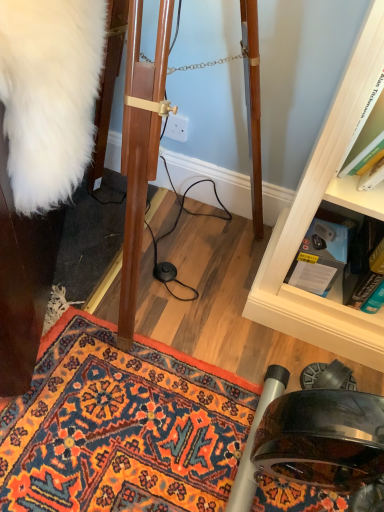
The height and width of the screenshot is (512, 384). Describe the element at coordinates (362, 263) in the screenshot. I see `hardcover book at lower right, which is the second book in left-to-right order` at that location.

Measure the distance between point [38,147] and camera.

They are 26.30 inches apart.

What are the coordinates of `white plastic power outlet at center` in the screenshot? It's located at (176, 127).

Is white fluffy coat at left looking in the opposite direction of blue cardboard box at lower right, marked as the 1th book in a left-to-right arrangement?

Answer: No, white fluffy coat at left is not facing the opposite direction of blue cardboard box at lower right, marked as the 1th book in a left-to-right arrangement.

Find the location of a particular element. fur coat lying on the left of blue cardboard box at lower right, acting as the second book starting from the right is located at coordinates (49, 95).

Considering the sizes of objects white fluffy coat at left and blue cardboard box at lower right, acting as the second book starting from the right, in the image provided, who is shorter, white fluffy coat at left or blue cardboard box at lower right, acting as the second book starting from the right,?

blue cardboard box at lower right, acting as the second book starting from the right.

Measure the distance between white fluffy coat at left and blue cardboard box at lower right, marked as the 1th book in a left-to-right arrangement.

They are 24.86 inches apart.

This screenshot has width=384, height=512. I want to click on doormat that is under the white plastic power outlet at center (from a real-world perspective), so click(x=121, y=426).

Is white plastic power outlet at center inside or outside of carpeted doormat at lower left?

white plastic power outlet at center is spatially situated outside carpeted doormat at lower left.

Considering the sizes of objects white plastic power outlet at center and carpeted doormat at lower left in the image provided, who is shorter, white plastic power outlet at center or carpeted doormat at lower left?

carpeted doormat at lower left is shorter.

Is blue cardboard box at lower right, acting as the second book starting from the right, inside the boundaries of white fluffy coat at left, or outside?

blue cardboard box at lower right, acting as the second book starting from the right, is outside white fluffy coat at left.

In the scene shown: Can you tell me how much blue cardboard box at lower right, marked as the 1th book in a left-to-right arrangement, and white fluffy coat at left differ in facing direction?

blue cardboard box at lower right, marked as the 1th book in a left-to-right arrangement, and white fluffy coat at left are facing 65.1 degrees away from each other.

Between blue cardboard box at lower right, marked as the 1th book in a left-to-right arrangement, and white fluffy coat at left, which one has less height?

With less height is blue cardboard box at lower right, marked as the 1th book in a left-to-right arrangement.

Can you confirm if blue cardboard box at lower right, marked as the 1th book in a left-to-right arrangement, is smaller than white fluffy coat at left?

Correct, blue cardboard box at lower right, marked as the 1th book in a left-to-right arrangement, occupies less space than white fluffy coat at left.

From a real-world perspective, who is located lower, white plastic power outlet at center or hardcover book at lower right, the first book viewed from the right?

From a 3D spatial view, hardcover book at lower right, the first book viewed from the right, is below.

Consider the image. In the image, is white plastic power outlet at center on the left side or the right side of hardcover book at lower right, which is the second book in left-to-right order?

From the image, it's evident that white plastic power outlet at center is to the left of hardcover book at lower right, which is the second book in left-to-right order.

Between white plastic power outlet at center and hardcover book at lower right, the first book viewed from the right, which one has smaller size?

With smaller size is white plastic power outlet at center.

Does white plastic power outlet at center have a lesser height compared to hardcover book at lower right, which is the second book in left-to-right order?

Yes, white plastic power outlet at center is shorter than hardcover book at lower right, which is the second book in left-to-right order.

Is blue cardboard box at lower right, acting as the second book starting from the right, in contact with carpeted doormat at lower left?

blue cardboard box at lower right, acting as the second book starting from the right, and carpeted doormat at lower left are not in contact.

From a real-world perspective, does blue cardboard box at lower right, marked as the 1th book in a left-to-right arrangement, sit lower than carpeted doormat at lower left?

No, from a real-world perspective, blue cardboard box at lower right, marked as the 1th book in a left-to-right arrangement, is not beneath carpeted doormat at lower left.

Which of these two, blue cardboard box at lower right, marked as the 1th book in a left-to-right arrangement, or carpeted doormat at lower left, is smaller?

Smaller between the two is blue cardboard box at lower right, marked as the 1th book in a left-to-right arrangement.

Is blue cardboard box at lower right, marked as the 1th book in a left-to-right arrangement, facing away from carpeted doormat at lower left?

No.

You are a GUI agent. You are given a task and a screenshot of the screen. Output one action in this format:
    pyautogui.click(x=<x>, y=<y>)
    Task: Click on the power outlet above the hardcover book at lower right, which is the second book in left-to-right order (from the image's perspective)
    This screenshot has width=384, height=512.
    Given the screenshot: What is the action you would take?
    pyautogui.click(x=176, y=127)

How much distance is there between hardcover book at lower right, the first book viewed from the right, and white plastic power outlet at center?

hardcover book at lower right, the first book viewed from the right, is 25.82 inches from white plastic power outlet at center.

Considering the positions of objects hardcover book at lower right, the first book viewed from the right, and white plastic power outlet at center in the image provided, who is more to the left, hardcover book at lower right, the first book viewed from the right, or white plastic power outlet at center?

From the viewer's perspective, white plastic power outlet at center appears more on the left side.

From a real-world perspective, is hardcover book at lower right, the first book viewed from the right, positioned under white plastic power outlet at center based on gravity?

Yes, from a real-world perspective, hardcover book at lower right, the first book viewed from the right, is below white plastic power outlet at center.

From the image's perspective, who appears lower, white plastic power outlet at center or white fluffy coat at left?

white fluffy coat at left, from the image's perspective.

Considering the sizes of objects white plastic power outlet at center and white fluffy coat at left in the image provided, who is taller, white plastic power outlet at center or white fluffy coat at left?

Standing taller between the two is white fluffy coat at left.

Which is behind, white plastic power outlet at center or white fluffy coat at left?

white plastic power outlet at center is behind.

The image size is (384, 512). Identify the location of fur coat on the left of blue cardboard box at lower right, marked as the 1th book in a left-to-right arrangement. pos(49,95).

Identify the location of doormat that appears below the white plastic power outlet at center (from a real-world perspective). This screenshot has height=512, width=384. (121, 426).

Looking at the image, which one is located closer to white plastic power outlet at center, white fluffy coat at left or blue cardboard box at lower right, acting as the second book starting from the right?

blue cardboard box at lower right, acting as the second book starting from the right, lies closer to white plastic power outlet at center than the other object.

Considering their positions, is white plastic power outlet at center positioned closer to hardcover book at lower right, which is the second book in left-to-right order, than carpeted doormat at lower left?

Based on the image, carpeted doormat at lower left appears to be nearer to hardcover book at lower right, which is the second book in left-to-right order.

In the scene shown: Estimate the real-world distances between objects in this image. Which object is closer to blue cardboard box at lower right, marked as the 1th book in a left-to-right arrangement, white plastic power outlet at center or white fluffy coat at left?

white plastic power outlet at center lies closer to blue cardboard box at lower right, marked as the 1th book in a left-to-right arrangement, than the other object.

Estimate the real-world distances between objects in this image. Which object is closer to carpeted doormat at lower left, blue cardboard box at lower right, acting as the second book starting from the right, or white plastic power outlet at center?

blue cardboard box at lower right, acting as the second book starting from the right, lies closer to carpeted doormat at lower left than the other object.

Considering their positions, is white plastic power outlet at center positioned closer to white fluffy coat at left than blue cardboard box at lower right, marked as the 1th book in a left-to-right arrangement?

white plastic power outlet at center is positioned closer to the anchor white fluffy coat at left.

Considering their positions, is hardcover book at lower right, which is the second book in left-to-right order, positioned closer to blue cardboard box at lower right, acting as the second book starting from the right, than carpeted doormat at lower left?

The object closer to blue cardboard box at lower right, acting as the second book starting from the right, is hardcover book at lower right, which is the second book in left-to-right order.

Looking at the image, which one is located further to white fluffy coat at left, white plastic power outlet at center or carpeted doormat at lower left?

white plastic power outlet at center is further to white fluffy coat at left.

Which object lies further to the anchor point blue cardboard box at lower right, acting as the second book starting from the right, hardcover book at lower right, which is the second book in left-to-right order, or white plastic power outlet at center?

white plastic power outlet at center lies further to blue cardboard box at lower right, acting as the second book starting from the right, than the other object.

Find the location of a particular element. The image size is (384, 512). doormat between white fluffy coat at left and white plastic power outlet at center in the front-back direction is located at coordinates (121, 426).

Locate an element on the screen. Image resolution: width=384 pixels, height=512 pixels. doormat between white fluffy coat at left and hardcover book at lower right, which is the second book in left-to-right order, from left to right is located at coordinates (121, 426).

You are a GUI agent. You are given a task and a screenshot of the screen. Output one action in this format:
    pyautogui.click(x=<x>, y=<y>)
    Task: Click on the book between white fluffy coat at left and hardcover book at lower right, the first book viewed from the right, in the horizontal direction
    The width and height of the screenshot is (384, 512).
    Given the screenshot: What is the action you would take?
    [319, 258]

Where is `book situated between carpeted doormat at lower left and hardcover book at lower right, the first book viewed from the right, from left to right`? The height and width of the screenshot is (512, 384). book situated between carpeted doormat at lower left and hardcover book at lower right, the first book viewed from the right, from left to right is located at coordinates (319, 258).